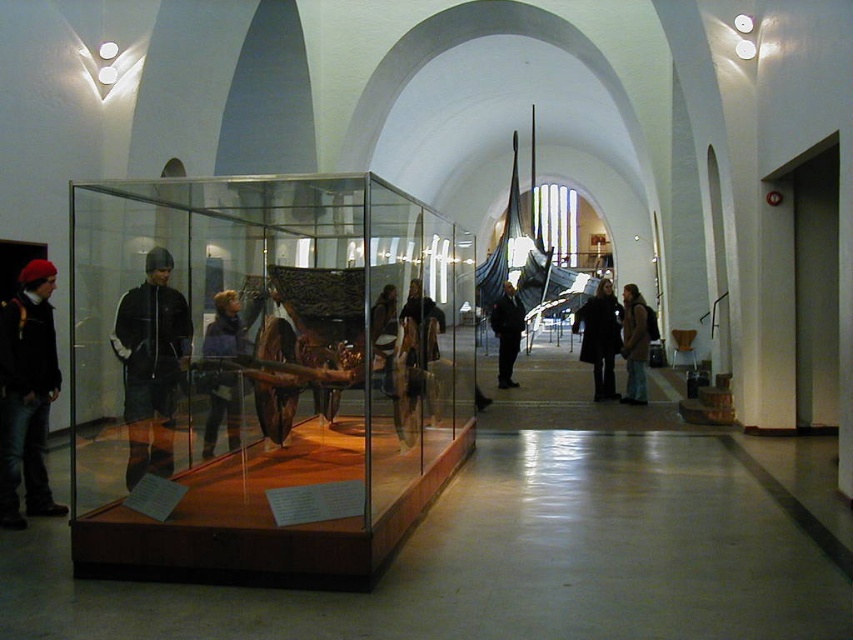
Who is lower down, black fabric jacket at left or black matte jacket at center?

Positioned lower is black fabric jacket at left.

Does black fabric jacket at left have a smaller size compared to black matte jacket at center?

No, black fabric jacket at left is not smaller than black matte jacket at center.

Image resolution: width=853 pixels, height=640 pixels. What do you see at coordinates (151, 364) in the screenshot?
I see `black fabric jacket at left` at bounding box center [151, 364].

This screenshot has width=853, height=640. Identify the location of black fabric jacket at left. (151, 364).

Is blue fuzzy jacket at center further to camera compared to dark brown leather coat at center?

No, blue fuzzy jacket at center is in front of dark brown leather coat at center.

Can you confirm if blue fuzzy jacket at center is positioned to the right of dark brown leather coat at center?

No, blue fuzzy jacket at center is not to the right of dark brown leather coat at center.

Between point (247, 339) and point (614, 308), which one is positioned in front?

Positioned in front is point (247, 339).

You are a GUI agent. You are given a task and a screenshot of the screen. Output one action in this format:
    pyautogui.click(x=<x>, y=<y>)
    Task: Click on the blue fuzzy jacket at center
    
    Given the screenshot: What is the action you would take?
    pyautogui.click(x=223, y=371)

Which is more to the left, black fabric jacket at left or brown leather jacket at center?

Positioned to the left is black fabric jacket at left.

Is black fabric jacket at left wider than brown leather jacket at center?

Indeed, black fabric jacket at left has a greater width compared to brown leather jacket at center.

Is point (161, 401) farther from camera compared to point (630, 348)?

No.

I want to click on black fabric jacket at left, so click(x=151, y=364).